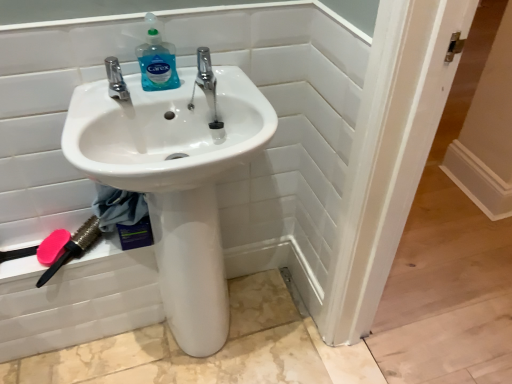
Question: Can you confirm if polished chrome tap at upper left, which is the 2th tap from right to left, is taller than pink matte brush at lower left?

Choices:
 (A) yes
 (B) no

Answer: (A)

Question: Is the depth of polished chrome tap at upper left, positioned as the 1th tap in left-to-right order, greater than that of pink matte brush at lower left?

Choices:
 (A) yes
 (B) no

Answer: (B)

Question: From a real-world perspective, is polished chrome tap at upper left, which is the 2th tap from right to left, positioned over pink matte brush at lower left based on gravity?

Choices:
 (A) yes
 (B) no

Answer: (A)

Question: From the image's perspective, does polished chrome tap at upper left, which is the 2th tap from right to left, appear lower than pink matte brush at lower left?

Choices:
 (A) no
 (B) yes

Answer: (A)

Question: Considering the relative positions of polished chrome tap at upper left, positioned as the 1th tap in left-to-right order, and pink matte brush at lower left in the image provided, is polished chrome tap at upper left, positioned as the 1th tap in left-to-right order, to the left of pink matte brush at lower left from the viewer's perspective?

Choices:
 (A) no
 (B) yes

Answer: (A)

Question: From the image's perspective, is polished chrome tap at upper left, which is the 2th tap from right to left, on pink matte brush at lower left?

Choices:
 (A) no
 (B) yes

Answer: (B)

Question: Is polished chrome tap at center, which ranks as the 2th tap in left-to-right order, far away from white glossy sink at center?

Choices:
 (A) no
 (B) yes

Answer: (A)

Question: Is polished chrome tap at center, the 1th tap positioned from the right, looking in the opposite direction of white glossy sink at center?

Choices:
 (A) yes
 (B) no

Answer: (A)

Question: From the image's perspective, does polished chrome tap at center, which ranks as the 2th tap in left-to-right order, appear lower than white glossy sink at center?

Choices:
 (A) no
 (B) yes

Answer: (A)

Question: From a real-world perspective, is polished chrome tap at center, the 1th tap positioned from the right, positioned over white glossy sink at center based on gravity?

Choices:
 (A) yes
 (B) no

Answer: (A)

Question: Does polished chrome tap at center, the 1th tap positioned from the right, have a lesser height compared to white glossy sink at center?

Choices:
 (A) yes
 (B) no

Answer: (A)

Question: Is polished chrome tap at center, which ranks as the 2th tap in left-to-right order, at the left side of white glossy sink at center?

Choices:
 (A) no
 (B) yes

Answer: (A)

Question: Is pink plastic brush at lower left positioned with its back to translucent plastic bottle at upper center?

Choices:
 (A) no
 (B) yes

Answer: (A)